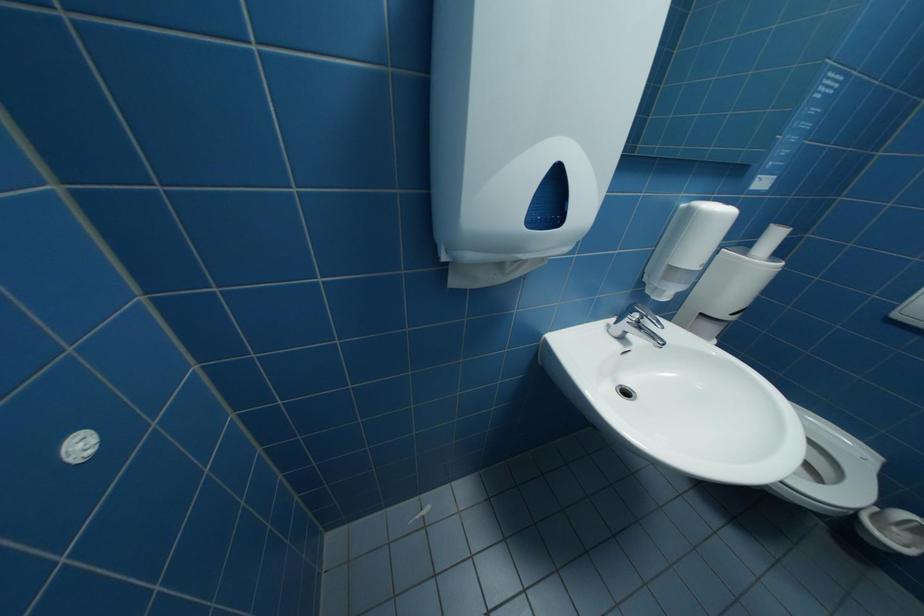
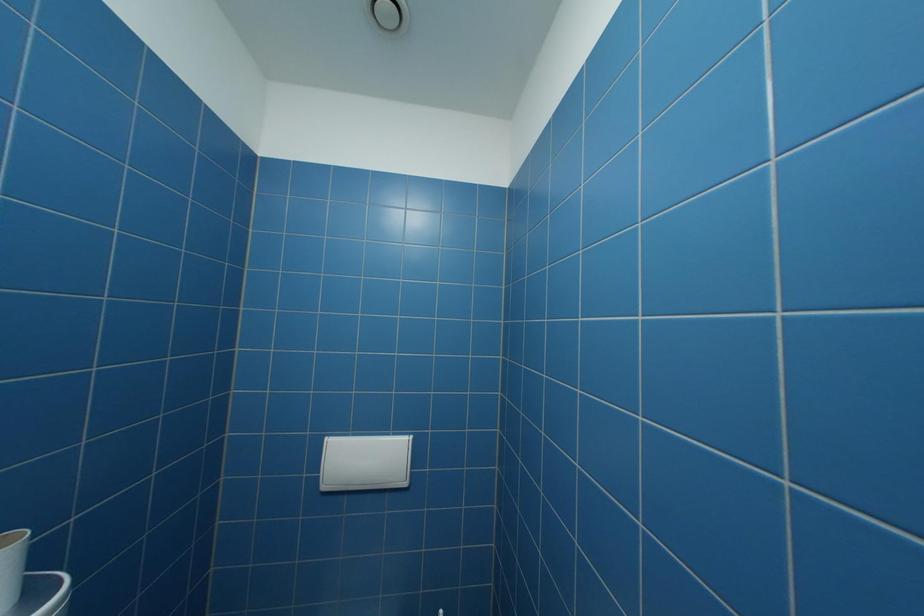
Question: Based on the continuous images, in which direction is the camera rotating? Reply with the corresponding letter.

Choices:
 (A) Left
 (B) Right
 (C) Up
 (D) Down

Answer: (B)